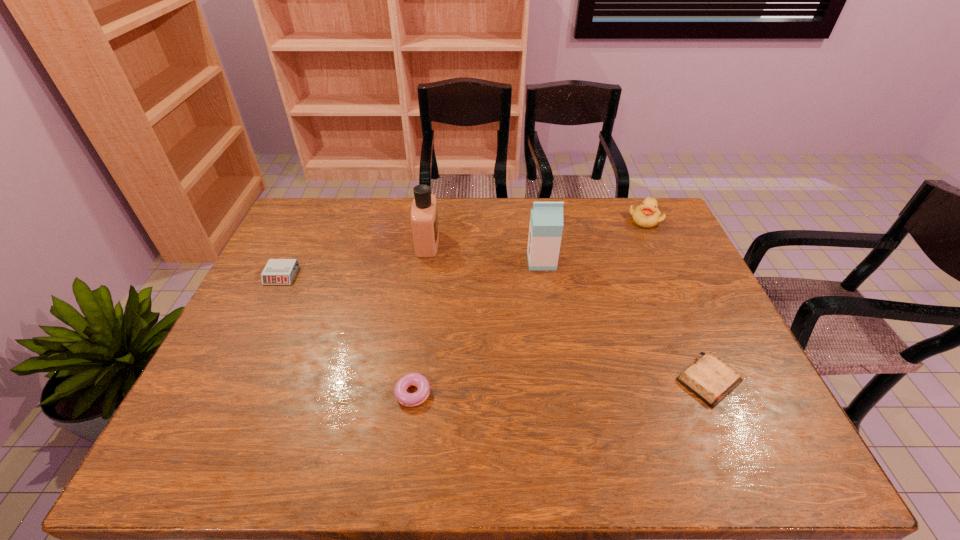
In order to click on the third object from right to left in this screenshot , I will do `click(546, 219)`.

This screenshot has width=960, height=540. Identify the location of perfume. (424, 213).

Where is `the farthest object`? the farthest object is located at coordinates (647, 215).

Identify the location of duckling. The image size is (960, 540). (647, 215).

Locate an element on the screen. The width and height of the screenshot is (960, 540). the leftmost object is located at coordinates (x=277, y=271).

Where is `doughnut`? The image size is (960, 540). doughnut is located at coordinates (412, 379).

This screenshot has width=960, height=540. I want to click on the shortest object, so click(x=711, y=379).

This screenshot has height=540, width=960. Identify the location of vacant space situated on the right of the milk carton. 649,261.

In order to click on free space located on the front label of the perfume in this screenshot , I will do `click(526, 243)`.

Image resolution: width=960 pixels, height=540 pixels. In order to click on free space located on the front-facing side of the farthest object in this screenshot , I will do `click(688, 313)`.